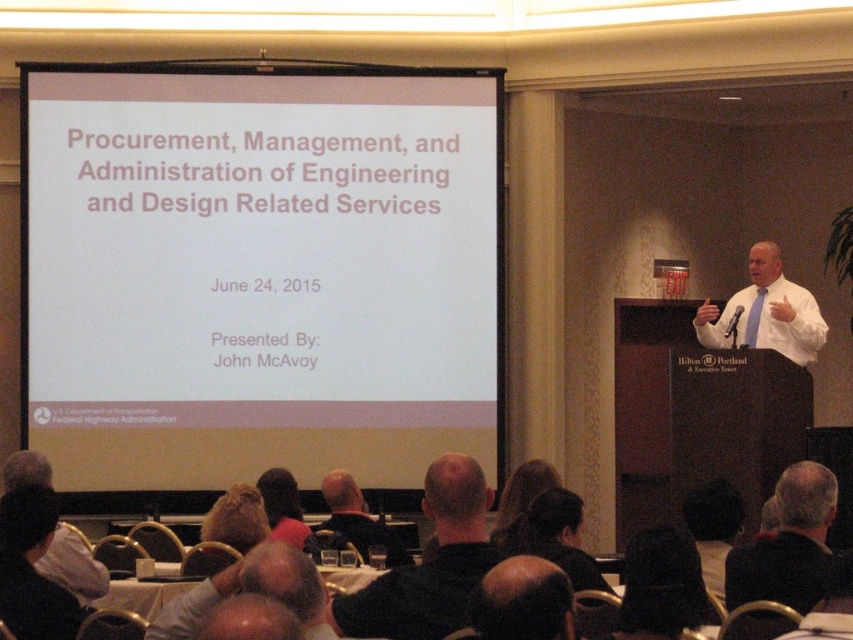
You are a photographer in the conference room. You need to take a photo of the presenter with the screen visible in the background. The screen is on the left side of the frame. Where should you position yourself relative to the black hair at lower center to ensure both the presenter and the screen are in the frame?

To capture both the presenter and the screen in the frame, position yourself to the left of the black hair at lower center. This allows the screen on the left side of the frame to be included while still framing the presenter.